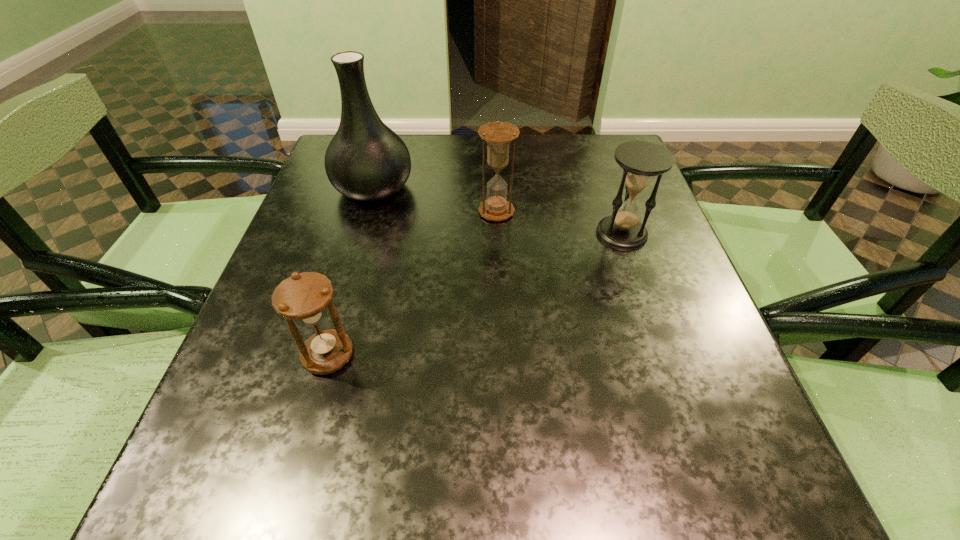
The image size is (960, 540). Find the location of `vase`. vase is located at coordinates (366, 161).

Where is `the second object from right to left`? the second object from right to left is located at coordinates (498, 135).

You are a GUI agent. You are given a task and a screenshot of the screen. Output one action in this format:
    pyautogui.click(x=<x>, y=<y>)
    Task: Click on the rightmost hourglass
    The height and width of the screenshot is (540, 960).
    Given the screenshot: What is the action you would take?
    pyautogui.click(x=641, y=161)

You are a GUI agent. You are given a task and a screenshot of the screen. Output one action in this format:
    pyautogui.click(x=<x>, y=<y>)
    Task: Click on the leftmost hourglass
    
    Given the screenshot: What is the action you would take?
    pyautogui.click(x=304, y=297)

Image resolution: width=960 pixels, height=540 pixels. Identify the location of the shortest object. (304, 297).

The image size is (960, 540). In order to click on free spot located 0.190m on the right of the vase in this screenshot , I will do `click(493, 188)`.

What are the coordinates of `free space located on the left of the second hourglass from left to right` in the screenshot? It's located at (318, 212).

At what (x,y) coordinates should I click in order to perform the action: click on free region located 0.090m on the back of the rightmost hourglass. Please return your answer as a coordinate pair (x, y). Looking at the image, I should click on pyautogui.click(x=608, y=194).

Locate an element on the screen. This screenshot has width=960, height=540. free region located 0.060m on the right of the nearest object is located at coordinates (390, 355).

Locate an element on the screen. object situated at the far edge is located at coordinates (366, 161).